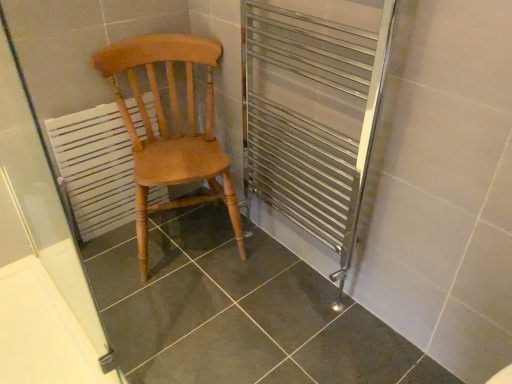
Question: Does light brown wood chair at center lie in front of white matte screen door at left?

Choices:
 (A) no
 (B) yes

Answer: (A)

Question: Is light brown wood chair at center smaller than white matte screen door at left?

Choices:
 (A) no
 (B) yes

Answer: (A)

Question: From a real-world perspective, is light brown wood chair at center beneath white matte screen door at left?

Choices:
 (A) yes
 (B) no

Answer: (A)

Question: Can you confirm if light brown wood chair at center is taller than white matte screen door at left?

Choices:
 (A) no
 (B) yes

Answer: (A)

Question: From a real-world perspective, is light brown wood chair at center physically above white matte screen door at left?

Choices:
 (A) yes
 (B) no

Answer: (B)

Question: In the image, is white matte screen door at left positioned in front of or behind light brown wood chair at center?

Choices:
 (A) front
 (B) behind

Answer: (A)

Question: Is white matte screen door at left taller or shorter than light brown wood chair at center?

Choices:
 (A) short
 (B) tall

Answer: (B)

Question: Based on their sizes in the image, would you say white matte screen door at left is bigger or smaller than light brown wood chair at center?

Choices:
 (A) small
 (B) big

Answer: (A)

Question: From a real-world perspective, is white matte screen door at left positioned above or below light brown wood chair at center?

Choices:
 (A) below
 (B) above

Answer: (B)

Question: In terms of height, does light brown wood chair at center look taller or shorter compared to white painted wood radiator at left?

Choices:
 (A) short
 (B) tall

Answer: (B)

Question: Does point (139, 218) appear closer or farther from the camera than point (112, 137)?

Choices:
 (A) closer
 (B) farther

Answer: (A)

Question: Is light brown wood chair at center spatially inside white painted wood radiator at left, or outside of it?

Choices:
 (A) outside
 (B) inside

Answer: (A)

Question: Visually, is light brown wood chair at center positioned to the left or to the right of white painted wood radiator at left?

Choices:
 (A) left
 (B) right

Answer: (B)

Question: Relative to white matte screen door at left, is white painted wood radiator at left in front or behind?

Choices:
 (A) behind
 (B) front

Answer: (A)

Question: Is white painted wood radiator at left bigger or smaller than white matte screen door at left?

Choices:
 (A) big
 (B) small

Answer: (B)